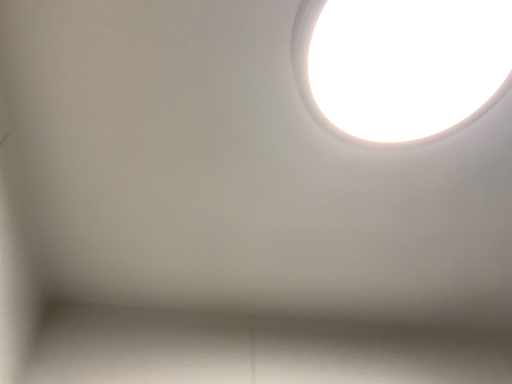
Image resolution: width=512 pixels, height=384 pixels. I want to click on transparent glass window at upper right, so click(400, 63).

Image resolution: width=512 pixels, height=384 pixels. What do you see at coordinates (400, 63) in the screenshot?
I see `transparent glass window at upper right` at bounding box center [400, 63].

At what (x,y) coordinates should I click in order to perform the action: click on transparent glass window at upper right. Please return your answer as a coordinate pair (x, y). The image size is (512, 384). Looking at the image, I should click on (400, 63).